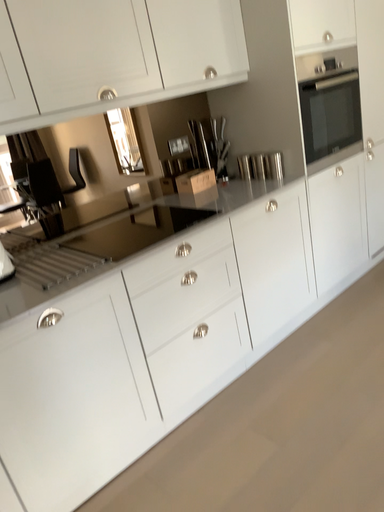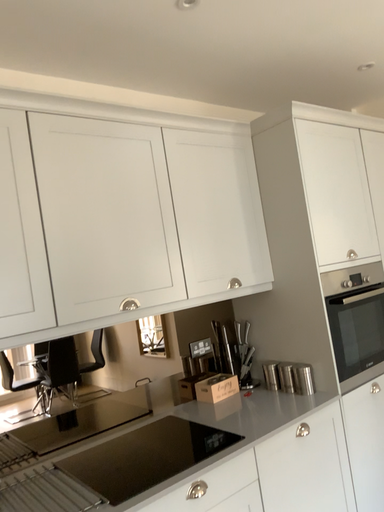
Question: Which way did the camera rotate in the video?

Choices:
 (A) rotated upward
 (B) rotated downward

Answer: (A)